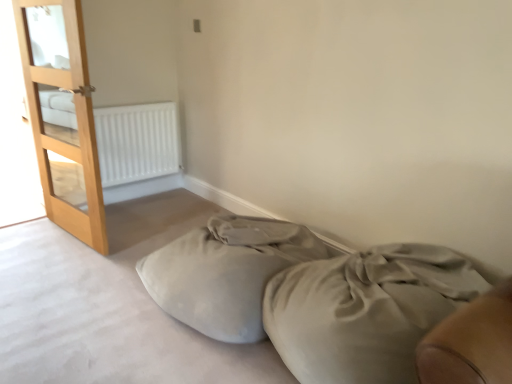
Question: In the image, is satin beige bed at lower right positioned in front of or behind soft beige fabric bean bag at lower center?

Choices:
 (A) behind
 (B) front

Answer: (B)

Question: Would you say satin beige bed at lower right is to the left or to the right of soft beige fabric bean bag at lower center in the picture?

Choices:
 (A) left
 (B) right

Answer: (B)

Question: Based on their relative distances, which object is nearer to the light brown wooden door at left?

Choices:
 (A) satin beige bed at lower right
 (B) soft beige fabric bean bag at lower center
 (C) white matte radiator at upper left

Answer: (C)

Question: Estimate the real-world distances between objects in this image. Which object is farther from the soft beige fabric bean bag at lower center?

Choices:
 (A) satin beige bed at lower right
 (B) light brown wooden door at left
 (C) white matte radiator at upper left

Answer: (C)